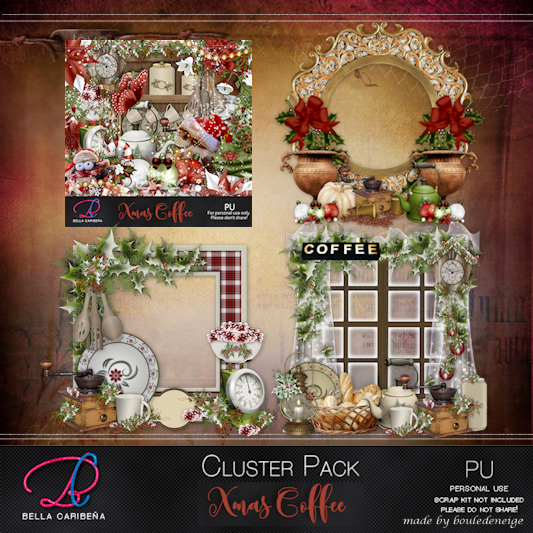
Identify the location of black "coffee" sign with white lettering. (305, 255).